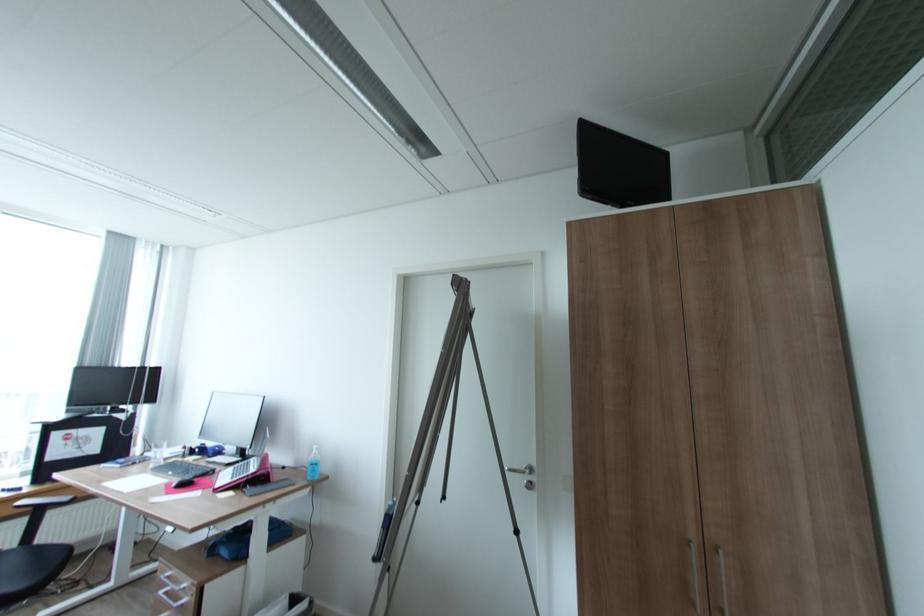
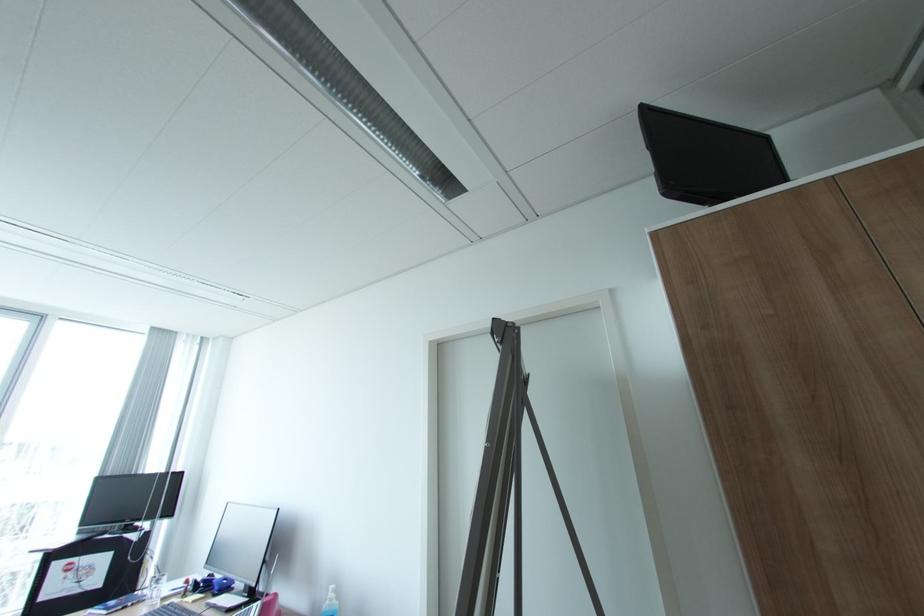
Question: How did the camera likely rotate?

Choices:
 (A) Left
 (B) Right
 (C) Up
 (D) Down

Answer: (C)